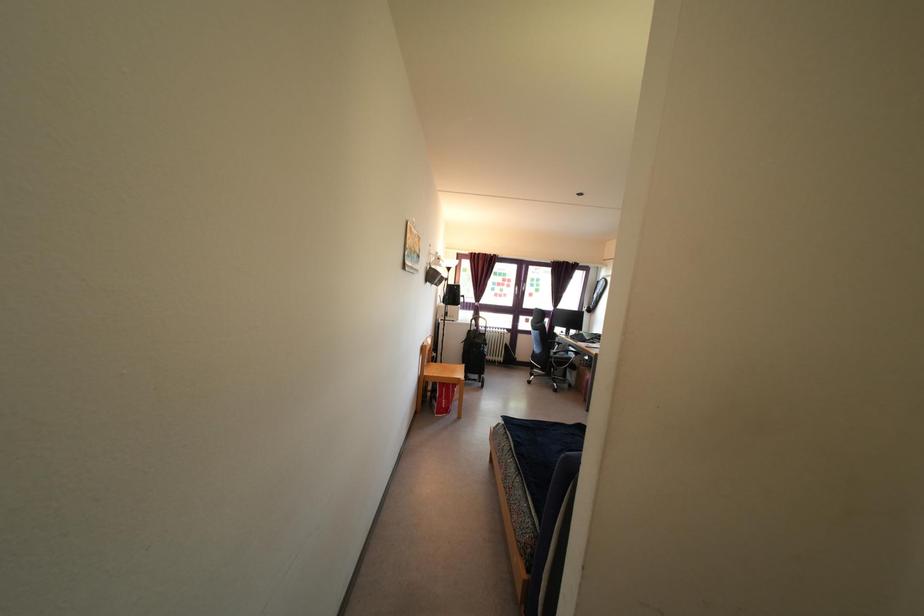
Image resolution: width=924 pixels, height=616 pixels. I want to click on chair armrest, so click(x=566, y=354).